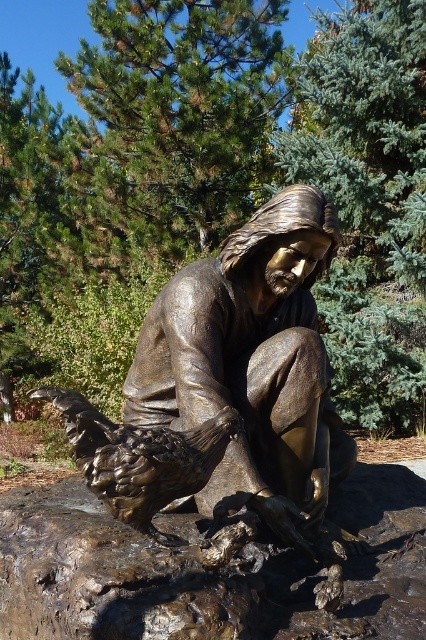
Question: Among these objects, which one is farthest from the camera?

Choices:
 (A) bronze statue at center
 (B) rusty metallic rock at center

Answer: (A)

Question: Can you confirm if rusty metallic rock at center is bigger than bronze statue at center?

Choices:
 (A) no
 (B) yes

Answer: (B)

Question: Is rusty metallic rock at center thinner than bronze statue at center?

Choices:
 (A) yes
 (B) no

Answer: (B)

Question: Which point is closer to the camera?

Choices:
 (A) rusty metallic rock at center
 (B) bronze statue at center

Answer: (A)

Question: Can you confirm if rusty metallic rock at center is positioned to the left of bronze statue at center?

Choices:
 (A) yes
 (B) no

Answer: (A)

Question: Which point is farther to the camera?

Choices:
 (A) bronze statue at center
 (B) rusty metallic rock at center

Answer: (A)